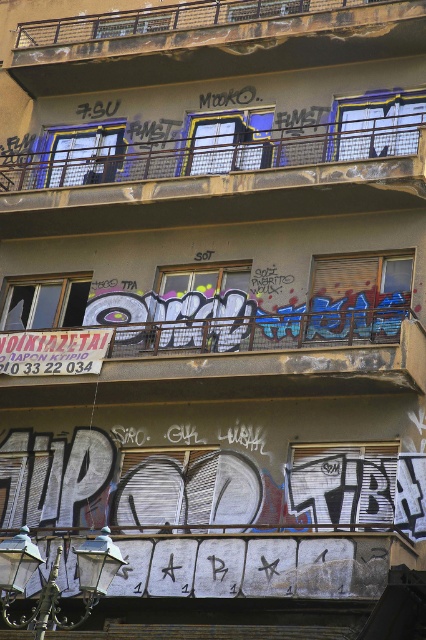
Question: Considering the relative positions of metallic graffiti at center and brushed metal balcony at upper center in the image provided, where is metallic graffiti at center located with respect to brushed metal balcony at upper center?

Choices:
 (A) left
 (B) right

Answer: (B)

Question: Which object is positioned closest to the brushed metal balcony at upper center?

Choices:
 (A) metallic graffiti at center
 (B) metallic mesh balcony at upper center

Answer: (B)

Question: Which object appears farthest from the camera in this image?

Choices:
 (A) brushed metal balcony at upper center
 (B) metallic mesh balcony at upper center

Answer: (A)

Question: Which object is positioned closest to the metallic graffiti at center?

Choices:
 (A) metallic mesh balcony at upper center
 (B) brushed metal balcony at upper center

Answer: (A)

Question: Where is metallic graffiti at center located in relation to metallic mesh balcony at upper center in the image?

Choices:
 (A) above
 (B) below

Answer: (B)

Question: Does metallic mesh balcony at upper center appear on the left side of brushed metal balcony at upper center?

Choices:
 (A) no
 (B) yes

Answer: (A)